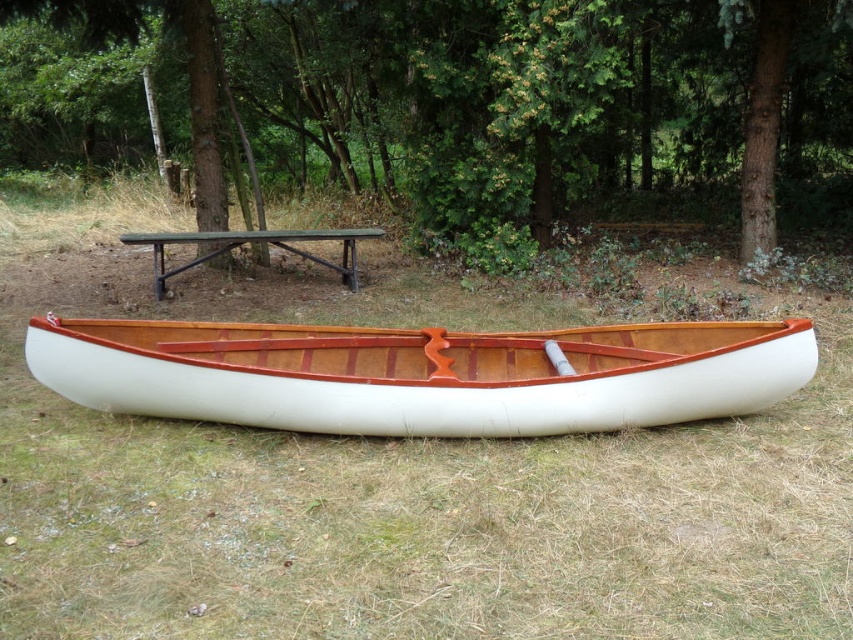
Does point (457, 109) come farther from viewer compared to point (354, 285)?

Yes, point (457, 109) is behind point (354, 285).

You are a GUI agent. You are given a task and a screenshot of the screen. Output one action in this format:
    pyautogui.click(x=<x>, y=<y>)
    Task: Click on the green leafy tree at center
    The image size is (853, 640).
    Given the screenshot: What is the action you would take?
    pyautogui.click(x=479, y=92)

From the picture: Does green leafy tree at center appear on the left side of white polished wood canoe at center?

Yes, green leafy tree at center is to the left of white polished wood canoe at center.

Can you confirm if green leafy tree at center is taller than white polished wood canoe at center?

Yes, green leafy tree at center is taller than white polished wood canoe at center.

Does point (283, 20) come in front of point (376, 390)?

No, (283, 20) is further to viewer.

The image size is (853, 640). What are the coordinates of `green leafy tree at center` in the screenshot? It's located at (479, 92).

Does white matte canoe at center appear over green leafy tree at center?

No, white matte canoe at center is not above green leafy tree at center.

Is white matte canoe at center in front of green leafy tree at center?

Yes, white matte canoe at center is closer to the viewer.

Is point (509, 552) less distant than point (506, 168)?

Yes, point (509, 552) is closer to viewer.

What are the coordinates of `white matte canoe at center` in the screenshot? It's located at (395, 474).